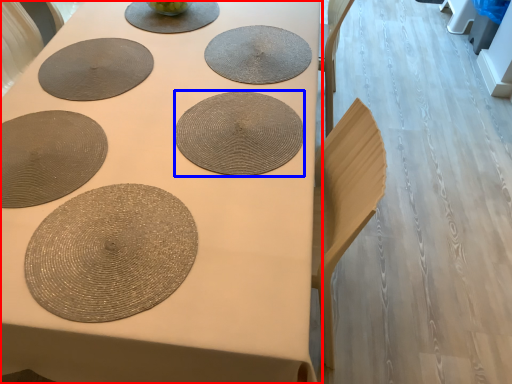
Question: Which of the following is the farthest to the observer, table (highlighted by a red box) or coaster (highlighted by a blue box)?

Choices:
 (A) table
 (B) coaster

Answer: (B)